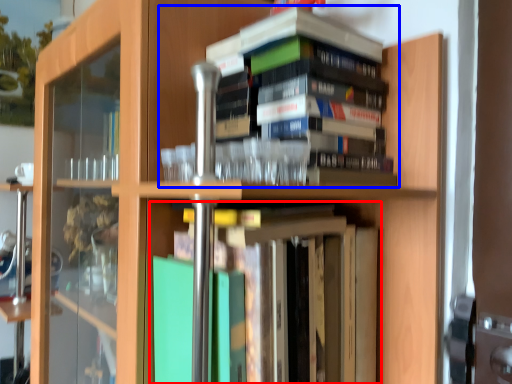
Question: Which point is closer to the camera, book (highlighted by a red box) or book (highlighted by a blue box)?

Choices:
 (A) book
 (B) book

Answer: (A)